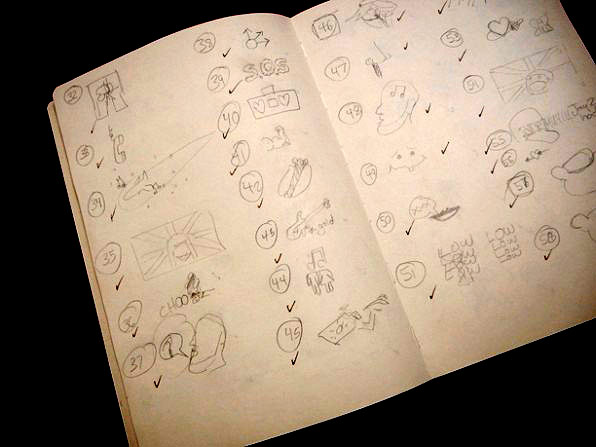
Where is `telephone receiver`? This screenshot has height=447, width=596. telephone receiver is located at coordinates (114, 151).